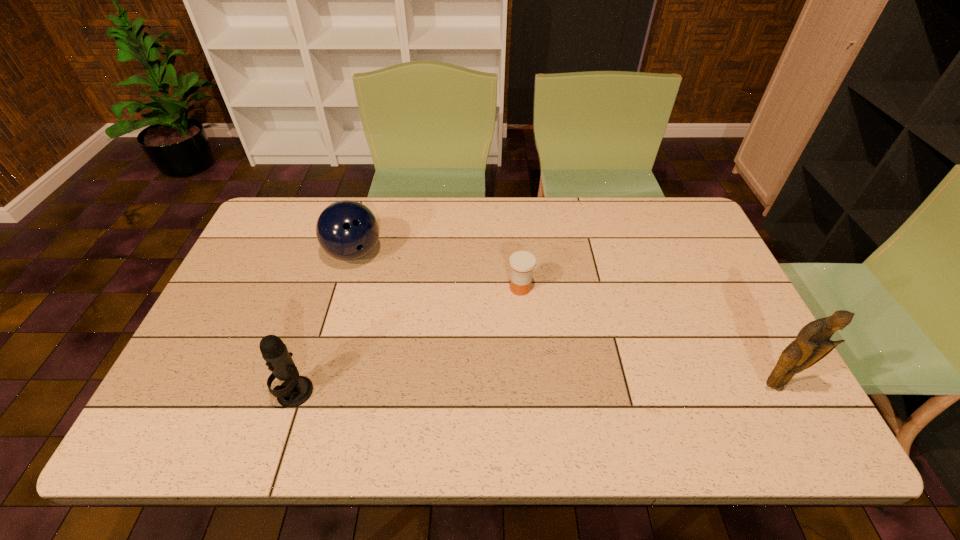
Where is `vacant space at the left edge of the desktop`? vacant space at the left edge of the desktop is located at coordinates (237, 342).

Image resolution: width=960 pixels, height=540 pixels. In the image, there is a desktop. What are the coordinates of `vacant region at the right edge` in the screenshot? It's located at (727, 366).

The width and height of the screenshot is (960, 540). I want to click on free space at the far left corner, so click(264, 239).

In the image, there is a desktop. Identify the location of free space at the far right corner. (660, 220).

Image resolution: width=960 pixels, height=540 pixels. Identify the location of free space between the rightmost object and the farthest object. (564, 320).

At what (x,y) coordinates should I click in order to perform the action: click on vacant point located between the farthest object and the microphone. Please return your answer as a coordinate pair (x, y). The width and height of the screenshot is (960, 540). Looking at the image, I should click on (324, 323).

You are a GUI agent. You are given a task and a screenshot of the screen. Output one action in this format:
    pyautogui.click(x=<x>, y=<y>)
    Task: Click on the vacant area that lies between the tallest object and the second farthest object
    The width and height of the screenshot is (960, 540).
    Given the screenshot: What is the action you would take?
    pyautogui.click(x=647, y=337)

Locate an element on the screen. Image resolution: width=960 pixels, height=540 pixels. vacant area between the microphone and the third nearest object is located at coordinates (408, 340).

The image size is (960, 540). Identify the location of empty space that is in between the rightmost object and the farthest object. (564, 320).

At what (x,y) coordinates should I click in order to perform the action: click on free space between the bowling ball and the microphone. Please return your answer as a coordinate pair (x, y). Image resolution: width=960 pixels, height=540 pixels. Looking at the image, I should click on (324, 323).